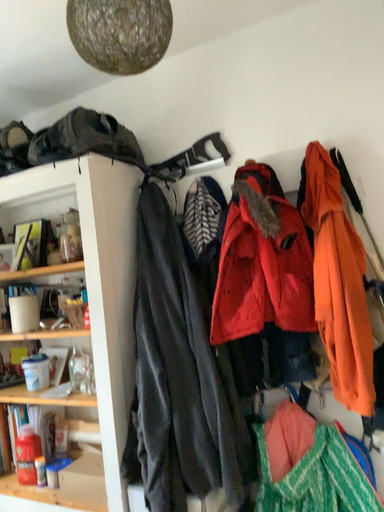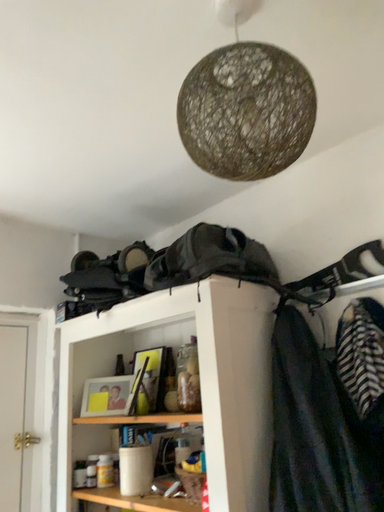
Question: Which way did the camera rotate in the video?

Choices:
 (A) rotated downward
 (B) rotated upward

Answer: (B)